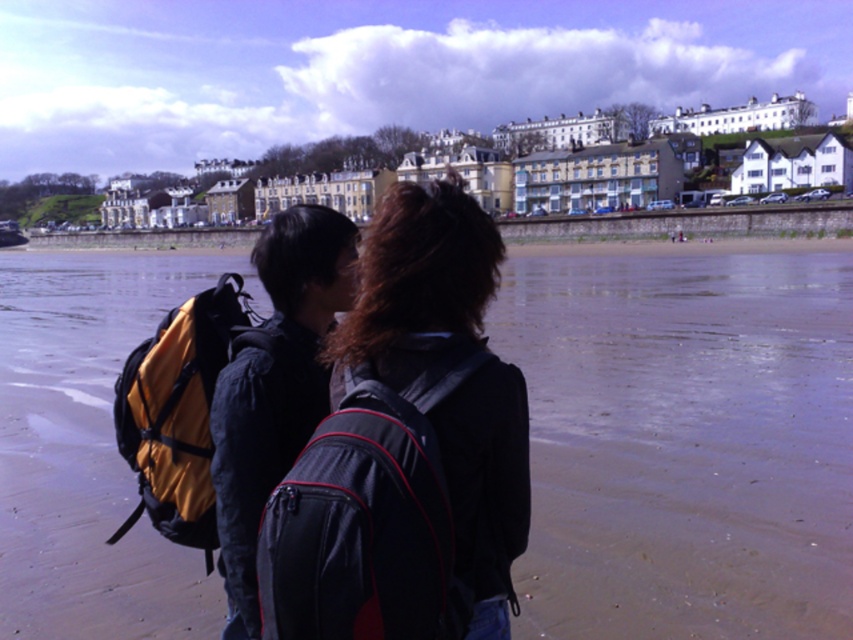
Question: Which of the following is the closest to the observer?

Choices:
 (A) (396, 282)
 (B) (758, 545)

Answer: (A)

Question: Does matte black backpack at center have a larger size compared to black fabric backpack at center?

Choices:
 (A) no
 (B) yes

Answer: (B)

Question: Does matte black backpack at center appear on the left side of black fabric backpack at center?

Choices:
 (A) no
 (B) yes

Answer: (A)

Question: Based on their relative distances, which object is nearer to the sandy beach at center?

Choices:
 (A) matte black backpack at center
 (B) yellow fabric backpack at left
 (C) black fabric backpack at center

Answer: (C)

Question: Which point is closer to the camera?

Choices:
 (A) (517, 582)
 (B) (282, 618)

Answer: (B)

Question: Is matte black backpack at center wider than yellow fabric backpack at left?

Choices:
 (A) yes
 (B) no

Answer: (B)